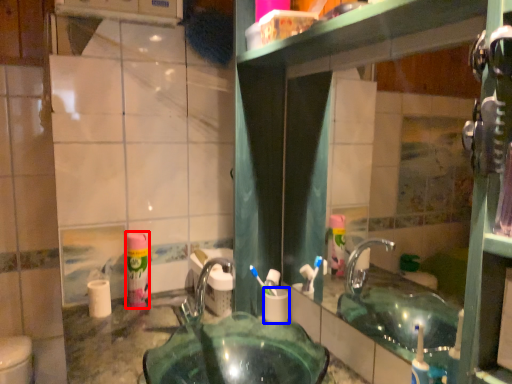
Question: Which point is closer to the camera, mouthwash (highlighted by a red box) or toilet paper (highlighted by a blue box)?

Choices:
 (A) mouthwash
 (B) toilet paper

Answer: (B)